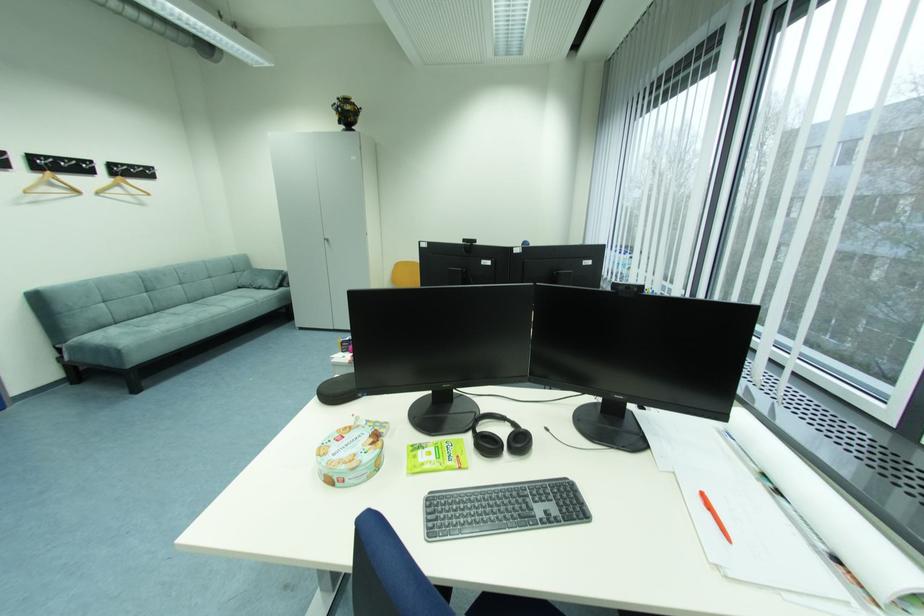
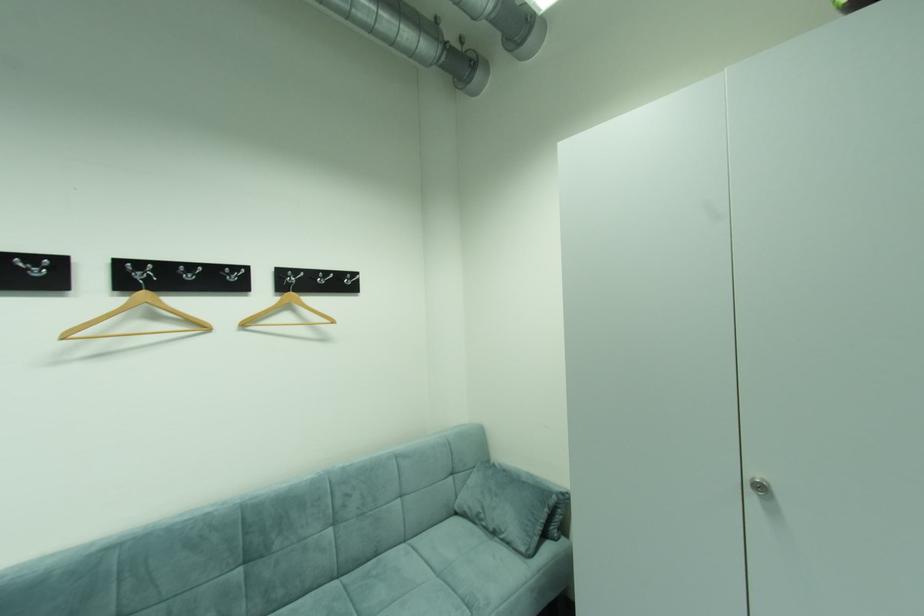
Where in the second image is the point corresponding to pixel 211 299 from the first image?

(383, 554)